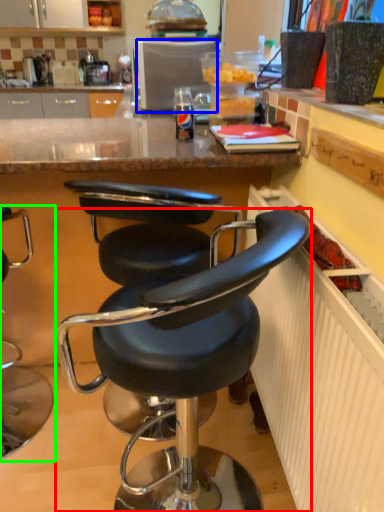
Question: Which is farther away from chair (highlighted by a red box)? appliance (highlighted by a blue box) or chair (highlighted by a green box)?

Choices:
 (A) appliance
 (B) chair

Answer: (A)